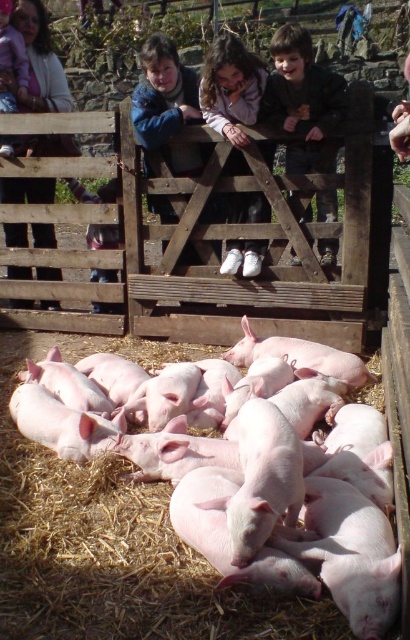
Question: Can you confirm if white sneakers at upper center is positioned below pink fabric at upper left?

Choices:
 (A) yes
 (B) no

Answer: (A)

Question: Estimate the real-world distances between objects in this image. Which object is closer to the pink smooth piglets at lower center?

Choices:
 (A) matte pink piglets at lower center
 (B) white sneakers at upper center
 (C) dark brown hair at upper center

Answer: (A)

Question: Estimate the real-world distances between objects in this image. Which object is farther from the pink smooth piglets at lower center?

Choices:
 (A) pink fabric at upper left
 (B) dark brown hair at upper center
 (C) matte pink piglets at lower center
 (D) white sneakers at upper center

Answer: (A)

Question: From the image, what is the correct spatial relationship of matte pink piglets at lower center in relation to pink fabric at upper left?

Choices:
 (A) right
 (B) left

Answer: (A)

Question: Observing the image, what is the correct spatial positioning of pink smooth piglets at lower center in reference to dark brown hair at upper center?

Choices:
 (A) above
 (B) below

Answer: (B)

Question: Which object appears closest to the camera in this image?

Choices:
 (A) matte pink piglets at lower center
 (B) pink fabric at upper left

Answer: (B)